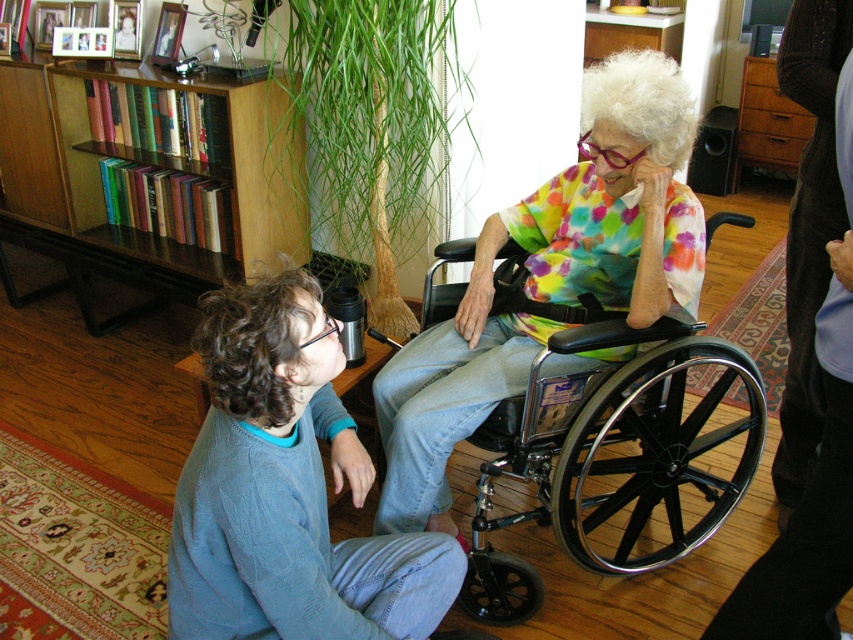
Question: Can you confirm if wooden bookshelf at upper left is positioned to the right of black metal wheelchair at center?

Choices:
 (A) yes
 (B) no

Answer: (B)

Question: Which of the following is the farthest from the observer?

Choices:
 (A) (x=585, y=72)
 (B) (x=102, y=115)

Answer: (B)

Question: Among these points, which one is farthest from the camera?

Choices:
 (A) 573,525
 (B) 260,209

Answer: (B)

Question: Which of the following is the closest to the observer?

Choices:
 (A) (637, 308)
 (B) (294, 161)
 (C) (641, 506)

Answer: (A)

Question: Is multicolored tie-dye shirt at center further to camera compared to wooden bookshelf at upper left?

Choices:
 (A) no
 (B) yes

Answer: (A)

Question: Is multicolored tie-dye shirt at center positioned behind wooden bookshelf at upper left?

Choices:
 (A) no
 (B) yes

Answer: (A)